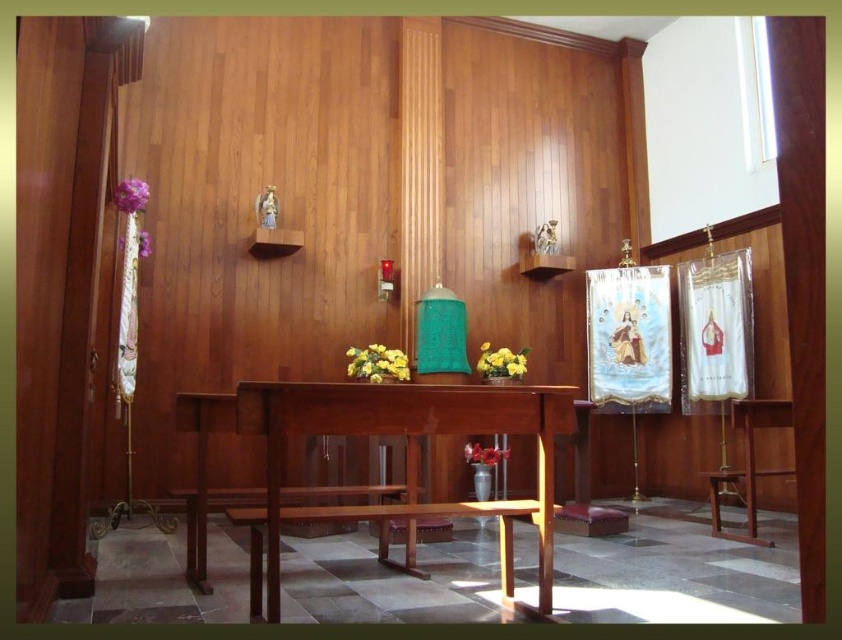
You are an interior designer planning to add a new decorative element to the chapel. You have a small golden bell that needs to be placed near the yellow matte flower at center and the purple fabric flower at upper left. Which flower should the bell be placed closer to if you want it to appear proportionally balanced with their sizes?

The yellow matte flower at center is larger in size than the purple fabric flower at upper left, so the bell should be placed closer to the purple fabric flower at upper left to achieve proportional balance.

Looking at this image, you are an interior designer planning to place a decorative item between the yellow matte flower at center and the purple fabric flower at upper left. Based on their sizes, which flower should you position closer to the edge to ensure the item fits comfortably?

The yellow matte flower at center might be wider than the purple fabric flower at upper left, so positioning the purple fabric flower at upper left closer to the edge would leave more space in the center for the decorative item.